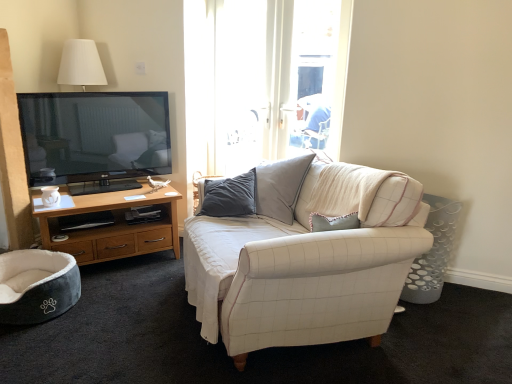
Question: From their relative heights in the image, would you say gray plush pet bed at lower left is taller or shorter than matte white coffee cup at left?

Choices:
 (A) short
 (B) tall

Answer: (B)

Question: From the image's perspective, relative to matte white coffee cup at left, is gray plush pet bed at lower left above or below?

Choices:
 (A) above
 (B) below

Answer: (B)

Question: Which is nearer to the matte white coffee cup at left?

Choices:
 (A) white fabric couch at center
 (B) gray plush pet bed at lower left
 (C) wooden cabinet at left

Answer: (C)

Question: Considering the real-world distances, which object is closest to the matte white coffee cup at left?

Choices:
 (A) gray plush pet bed at lower left
 (B) white fabric couch at center
 (C) wooden cabinet at left

Answer: (C)